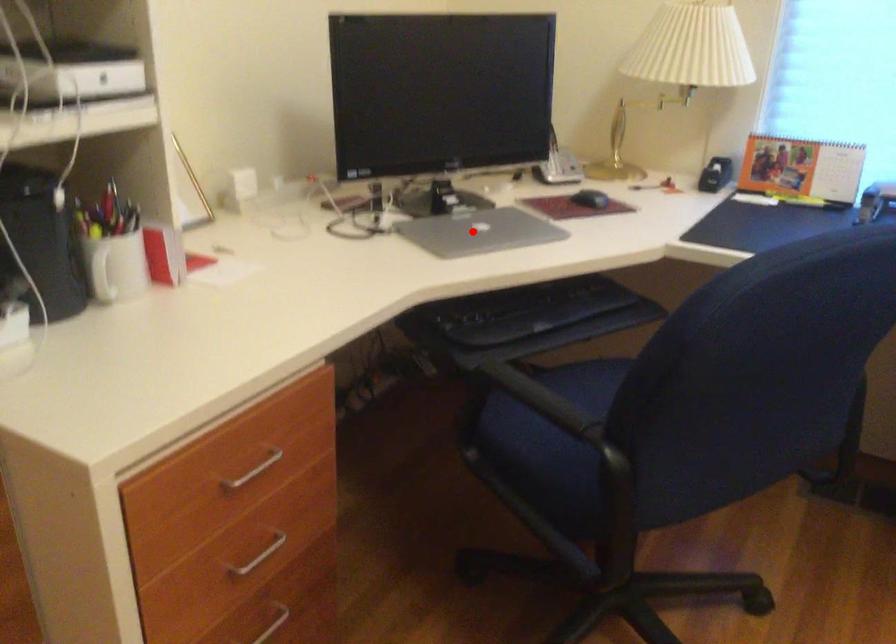
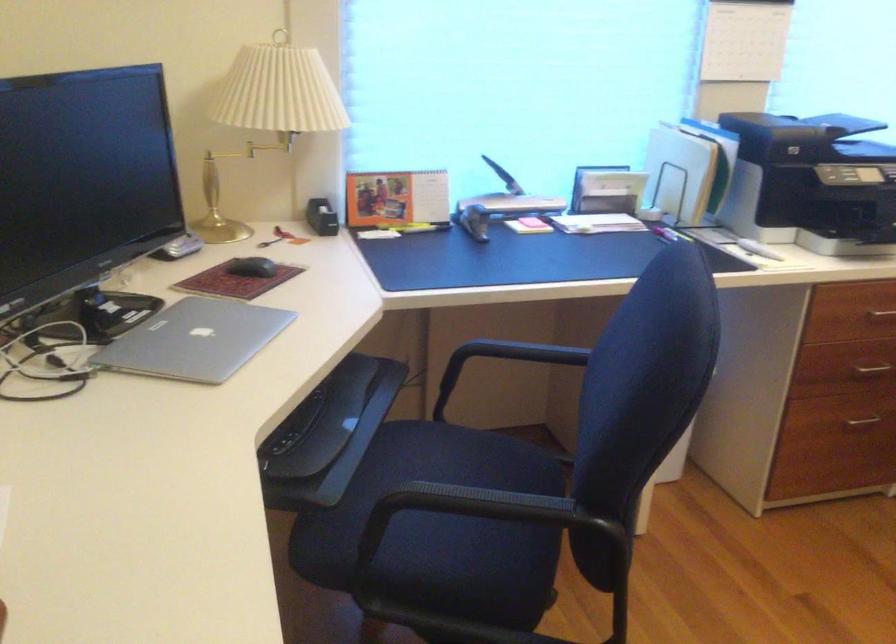
Where in the second image is the point corresponding to the highlighted location from the first image?

(194, 339)